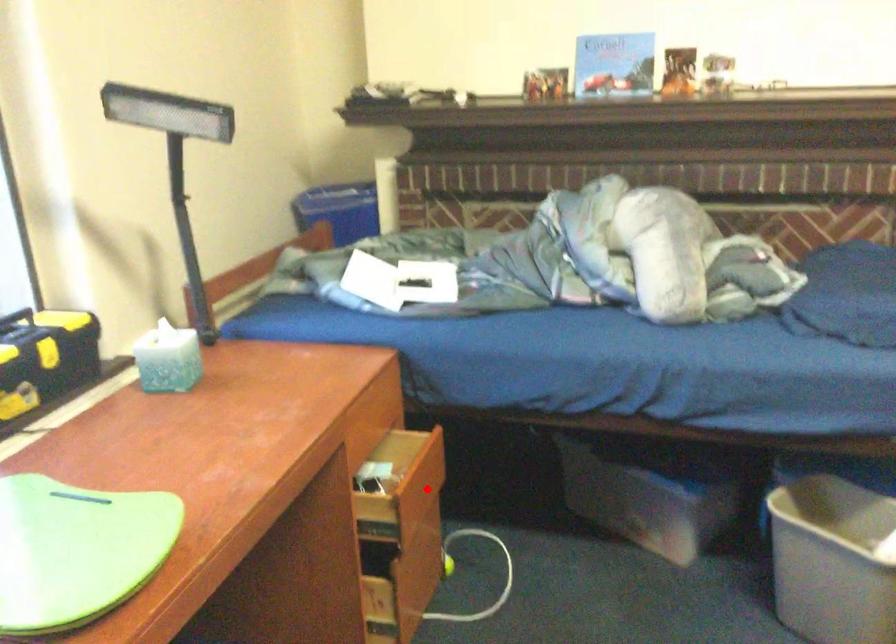
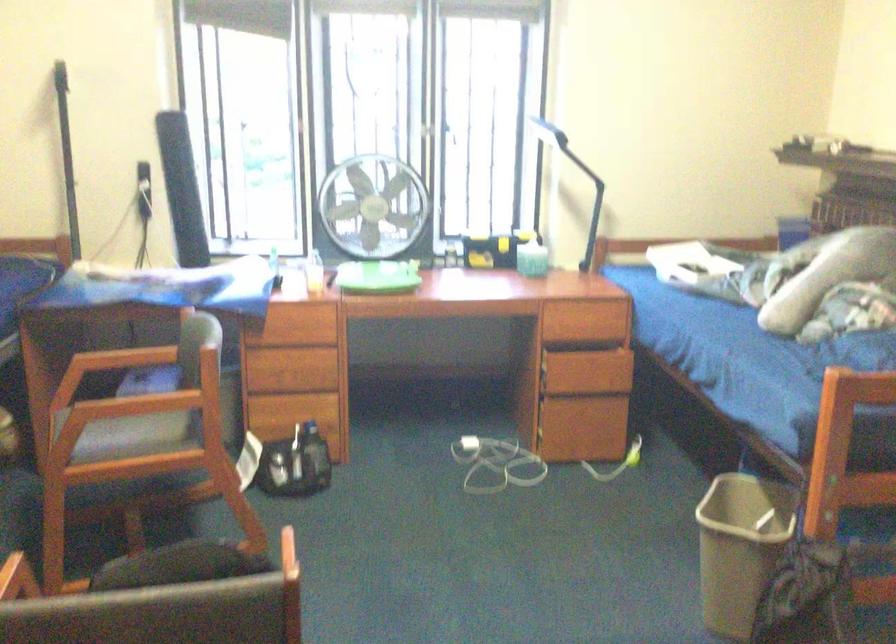
Find the pixel in the second image that matches the highlighted location in the first image.

(601, 375)